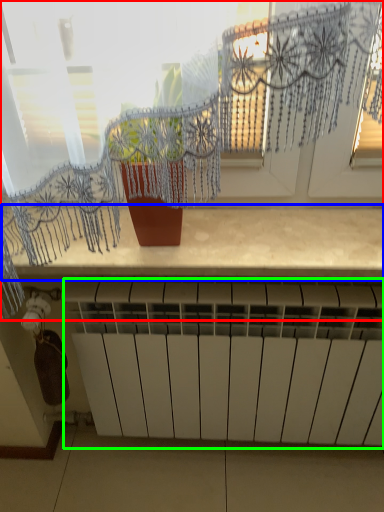
Question: Which object is the farthest from window (highlighted by a red box)? Choose among these: counter top (highlighted by a blue box) or radiator (highlighted by a green box).

Choices:
 (A) counter top
 (B) radiator

Answer: (B)